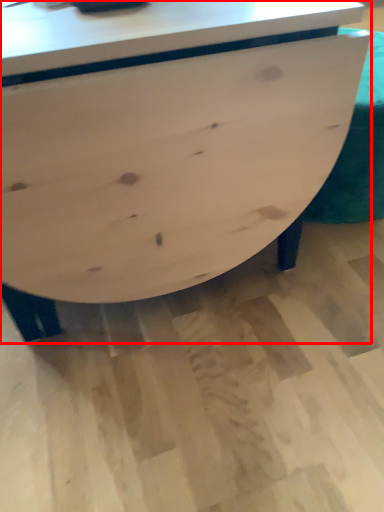
Question: From the image's perspective, where is table (annotated by the red box) located relative to swivel chair?

Choices:
 (A) above
 (B) below

Answer: (B)